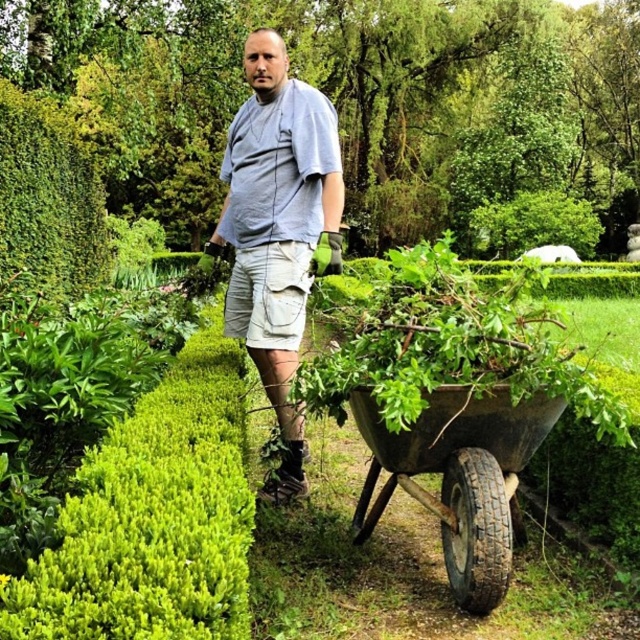
You are a delivery person carrying a package that is 1.3 meters long. You need to walk through the garden to reach the front door. Is there enough space between you and the green leafy bush at center to pass safely without hitting the package against the bush?

The distance between you and the green leafy bush at center is 1.29 meters, which is slightly shorter than the 1.3 meter package. Therefore, there isn not enough space to pass safely without risking the package hitting the bush.

You are a gardener who needs to reach the green leafy bush at center to prune it. You have a 3.5 feet long pruning tool. Can you reach the bush without moving closer?

The green leafy bush at center is 4.22 feet from viewer, which is farther than the pruning tool length of 3.5 feet. Therefore, you cannot reach the bush without moving closer.

You are a photographer wanting to capture the man in the gray cotton shirt at center and the rusty metal wheelbarrow at lower right in the same frame. Based on their positions, which object is closer to the left side of the image?

The gray cotton shirt at center is to the left of the rusty metal wheelbarrow at lower right, so the gray cotton shirt at center is closer to the left side of the image.